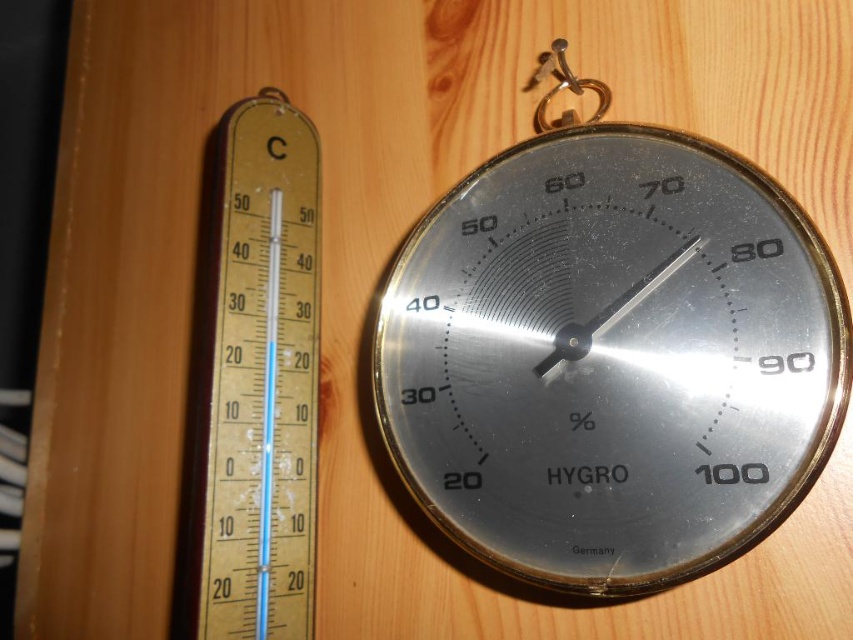
Image resolution: width=853 pixels, height=640 pixels. In order to click on gold textured thermometer at left in this screenshot , I will do `click(262, 380)`.

Which is more to the left, gold textured thermometer at left or gold metallic hook at upper center?

gold textured thermometer at left is more to the left.

This screenshot has height=640, width=853. Identify the location of gold textured thermometer at left. (262, 380).

I want to click on gold textured thermometer at left, so click(x=262, y=380).

Who is positioned more to the right, metallic silver hygrometer at center or gold metallic hook at upper center?

From the viewer's perspective, metallic silver hygrometer at center appears more on the right side.

Between point (485, 412) and point (543, 72), which one is positioned in front?

Point (485, 412) is in front.

Is point (596, 316) farther from viewer compared to point (606, 99)?

No, (596, 316) is in front of (606, 99).

This screenshot has width=853, height=640. I want to click on metallic silver hygrometer at center, so click(x=611, y=358).

Between metallic silver hygrometer at center and gold textured thermometer at left, which one appears on the right side from the viewer's perspective?

From the viewer's perspective, metallic silver hygrometer at center appears more on the right side.

At what (x,y) coordinates should I click in order to perform the action: click on metallic silver hygrometer at center. Please return your answer as a coordinate pair (x, y). The width and height of the screenshot is (853, 640). Looking at the image, I should click on (611, 358).

This screenshot has height=640, width=853. I want to click on metallic silver hygrometer at center, so click(611, 358).